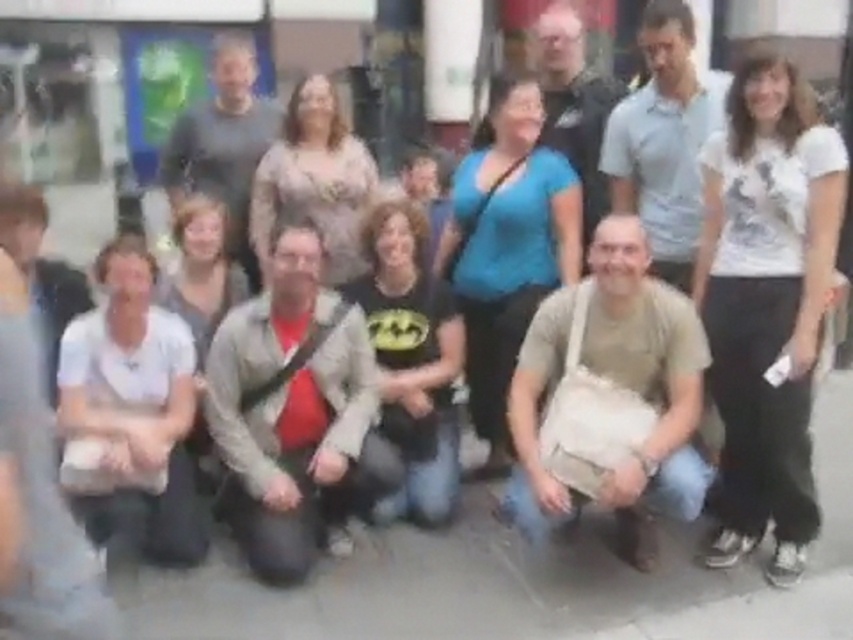
Question: Can you confirm if matte beige dress at center is smaller than matte gray hoodie at center?

Choices:
 (A) yes
 (B) no

Answer: (B)

Question: Among these objects, which one is nearest to the camera?

Choices:
 (A) matte gray hoodie at center
 (B) light beige sweater at center
 (C) blue matte shirt at center

Answer: (B)

Question: Where is white cotton shirt at lower left located in relation to black matte shirt at center in the image?

Choices:
 (A) right
 (B) left

Answer: (B)

Question: Can you confirm if light beige sweater at center is positioned to the right of matte beige dress at center?

Choices:
 (A) yes
 (B) no

Answer: (A)

Question: Which object is closer to the camera taking this photo?

Choices:
 (A) black matte shirt at center
 (B) blue matte shirt at center
 (C) white matte shirt at upper right

Answer: (C)

Question: Which object appears farthest from the camera in this image?

Choices:
 (A) light beige sweater at center
 (B) black matte shirt at center

Answer: (B)